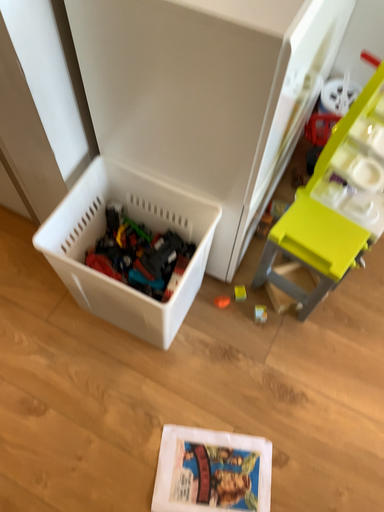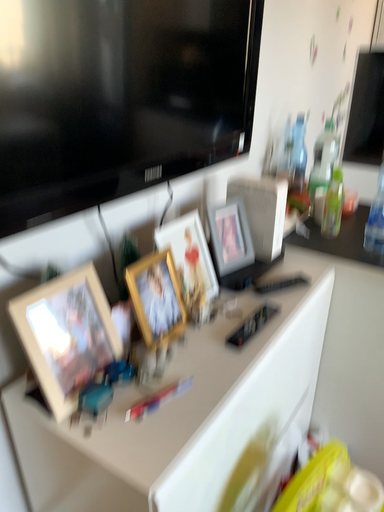
Question: Which way did the camera rotate in the video?

Choices:
 (A) rotated upward
 (B) rotated downward

Answer: (A)